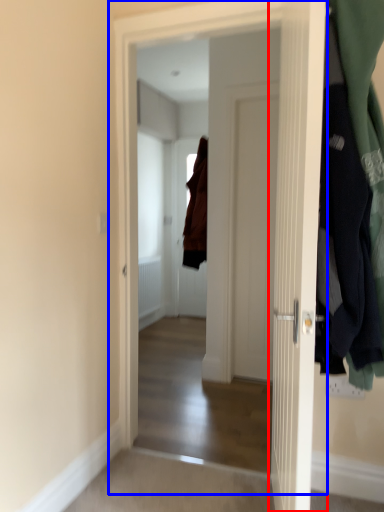
Question: Which of the following is the closest to the observer, door (highlighted by a red box) or door (highlighted by a blue box)?

Choices:
 (A) door
 (B) door

Answer: (A)